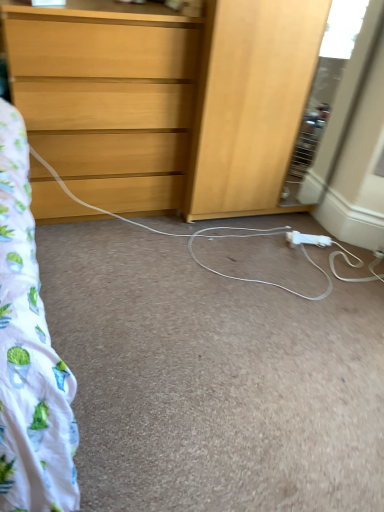
Question: Does white plastic extension cord at lower center have a greater height compared to light wood chest of drawers at upper left?

Choices:
 (A) no
 (B) yes

Answer: (A)

Question: From a real-world perspective, is white plastic extension cord at lower center on top of light wood chest of drawers at upper left?

Choices:
 (A) no
 (B) yes

Answer: (A)

Question: Is white plastic extension cord at lower center to the left of light wood chest of drawers at upper left from the viewer's perspective?

Choices:
 (A) no
 (B) yes

Answer: (A)

Question: Is white plastic extension cord at lower center not inside light wood chest of drawers at upper left?

Choices:
 (A) yes
 (B) no

Answer: (A)

Question: Can you confirm if white plastic extension cord at lower center is bigger than light wood chest of drawers at upper left?

Choices:
 (A) no
 (B) yes

Answer: (A)

Question: Is white plastic extension cord at lower center shorter than light wood chest of drawers at upper left?

Choices:
 (A) no
 (B) yes

Answer: (B)

Question: Could you tell me if light wood chest of drawers at upper left is facing white plastic extension cord at lower center?

Choices:
 (A) no
 (B) yes

Answer: (A)

Question: From a real-world perspective, is light wood chest of drawers at upper left over white plastic extension cord at lower center?

Choices:
 (A) no
 (B) yes

Answer: (B)

Question: Can you confirm if light wood chest of drawers at upper left is shorter than white plastic extension cord at lower center?

Choices:
 (A) yes
 (B) no

Answer: (B)

Question: Does light wood chest of drawers at upper left contain white plastic extension cord at lower center?

Choices:
 (A) yes
 (B) no

Answer: (B)

Question: Does light wood chest of drawers at upper left have a lesser width compared to white plastic extension cord at lower center?

Choices:
 (A) yes
 (B) no

Answer: (B)

Question: Can you confirm if light wood chest of drawers at upper left is taller than white plastic extension cord at lower center?

Choices:
 (A) yes
 (B) no

Answer: (A)

Question: Is light wood chest of drawers at upper left situated inside white plastic extension cord at lower center or outside?

Choices:
 (A) inside
 (B) outside

Answer: (B)